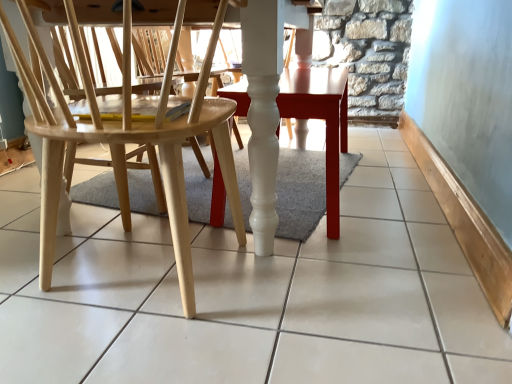
Find the location of a particular element. vacant area situated below white glossy table at center (from a real-world perspective) is located at coordinates (295, 180).